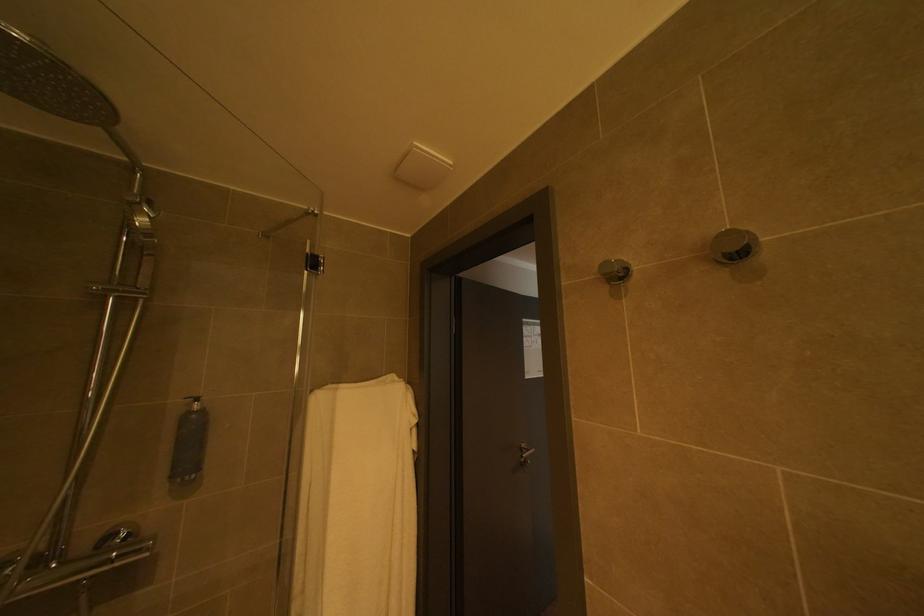
This screenshot has height=616, width=924. Identify the location of dispenser pump. (195, 398).